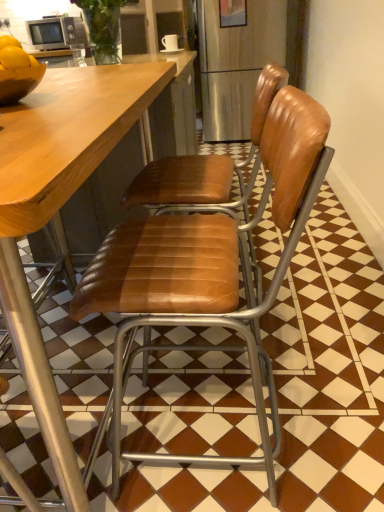
What do you see at coordinates (170, 42) in the screenshot?
I see `white glossy mug at upper center` at bounding box center [170, 42].

I want to click on brown leather chair at center, the 1th chair from the back, so click(203, 162).

Identify the location of brown leather chair at center, which ranks as the 1th chair in front-to-back order. 207,271.

Find the location of `white glossy mug at upper center`. white glossy mug at upper center is located at coordinates 170,42.

From the picture: From the image's perspective, is white glossy mug at upper center located above shiny brown bowl at left?

Yes, from the image's perspective, white glossy mug at upper center is above shiny brown bowl at left.

Would you say white glossy mug at upper center contains shiny brown bowl at left?

No, shiny brown bowl at left is not inside white glossy mug at upper center.

Does white glossy mug at upper center have a smaller size compared to shiny brown bowl at left?

Indeed, white glossy mug at upper center has a smaller size compared to shiny brown bowl at left.

Who is shorter, white glossy mug at upper center or shiny brown bowl at left?

shiny brown bowl at left is shorter.

Which is less distant, (214,168) or (45,21)?

The point (214,168) is closer.

In the scene shown: Considering the sizes of objects brown leather chair at center, acting as the second chair starting from the front, and matte silver microwave at upper left in the image provided, who is bigger, brown leather chair at center, acting as the second chair starting from the front, or matte silver microwave at upper left?

Bigger between the two is brown leather chair at center, acting as the second chair starting from the front.

Looking at this image, is matte silver microwave at upper left not within shiny brown bowl at left?

matte silver microwave at upper left lies outside shiny brown bowl at left's area.

Is matte silver microwave at upper left positioned before shiny brown bowl at left?

No, matte silver microwave at upper left is further to the viewer.

Can you confirm if white glossy mug at upper center is bigger than brown leather chair at center, the 1th chair from the back?

Incorrect, white glossy mug at upper center is not larger than brown leather chair at center, the 1th chair from the back.

Is point (169, 50) positioned after point (264, 115)?

That is True.

From a real-world perspective, is white glossy mug at upper center physically above brown leather chair at center, acting as the second chair starting from the front?

Indeed, from a real-world perspective, white glossy mug at upper center stands above brown leather chair at center, acting as the second chair starting from the front.

Looking at this image, how different are the orientations of matte silver microwave at upper left and brown leather chair at center, which appears as the second chair when viewed from the back, in degrees?

92.4 degrees separate the facing orientations of matte silver microwave at upper left and brown leather chair at center, which appears as the second chair when viewed from the back.

From the image's perspective, who appears lower, matte silver microwave at upper left or brown leather chair at center, which ranks as the 1th chair in front-to-back order?

brown leather chair at center, which ranks as the 1th chair in front-to-back order, from the image's perspective.

Between point (46, 36) and point (127, 455), which one is positioned in front?

Positioned in front is point (127, 455).

Who is more distant, matte silver microwave at upper left or brown leather chair at center, which ranks as the 1th chair in front-to-back order?

matte silver microwave at upper left.

Is matte silver microwave at upper left far from brown leather chair at center, the 1th chair from the back?

Indeed, matte silver microwave at upper left is not near brown leather chair at center, the 1th chair from the back.

From their relative heights in the image, would you say matte silver microwave at upper left is taller or shorter than brown leather chair at center, acting as the second chair starting from the front?

Clearly, matte silver microwave at upper left is shorter compared to brown leather chair at center, acting as the second chair starting from the front.

Can we say matte silver microwave at upper left lies outside brown leather chair at center, acting as the second chair starting from the front?

Yes, matte silver microwave at upper left is outside of brown leather chair at center, acting as the second chair starting from the front.

From a real-world perspective, does matte silver microwave at upper left sit lower than brown leather chair at center, the 1th chair from the back?

No, from a real-world perspective, matte silver microwave at upper left is not under brown leather chair at center, the 1th chair from the back.

Is the depth of brown leather chair at center, acting as the second chair starting from the front, greater than that of brown leather chair at center, which ranks as the 1th chair in front-to-back order?

Yes, it is.

Looking at the image, does brown leather chair at center, acting as the second chair starting from the front, seem bigger or smaller compared to brown leather chair at center, which ranks as the 1th chair in front-to-back order?

Clearly, brown leather chair at center, acting as the second chair starting from the front, is larger in size than brown leather chair at center, which ranks as the 1th chair in front-to-back order.

Choose the correct answer: Is brown leather chair at center, acting as the second chair starting from the front, inside brown leather chair at center, which ranks as the 1th chair in front-to-back order, or outside it?

brown leather chair at center, acting as the second chair starting from the front, is located beyond the bounds of brown leather chair at center, which ranks as the 1th chair in front-to-back order.

Locate an element on the screen. This screenshot has width=384, height=512. bowl lying in front of the white glossy mug at upper center is located at coordinates (19, 82).

Image resolution: width=384 pixels, height=512 pixels. I want to click on microwave oven to the left of brown leather chair at center, acting as the second chair starting from the front, so click(56, 33).

Which object lies further to the anchor point brown leather chair at center, which ranks as the 1th chair in front-to-back order, brown leather chair at center, acting as the second chair starting from the front, or shiny brown bowl at left?

Among the two, shiny brown bowl at left is located further to brown leather chair at center, which ranks as the 1th chair in front-to-back order.

When comparing their distances from brown leather chair at center, the 1th chair from the back, does shiny brown bowl at left or brown leather chair at center, which appears as the second chair when viewed from the back, seem closer?

brown leather chair at center, which appears as the second chair when viewed from the back, lies closer to brown leather chair at center, the 1th chair from the back, than the other object.

Considering their positions, is white glossy mug at upper center positioned further to shiny brown bowl at left than brown leather chair at center, which appears as the second chair when viewed from the back?

Among the two, white glossy mug at upper center is located further to shiny brown bowl at left.

Based on their spatial positions, is brown leather chair at center, which ranks as the 1th chair in front-to-back order, or matte silver microwave at upper left further from shiny brown bowl at left?

The object further to shiny brown bowl at left is matte silver microwave at upper left.

From the image, which object appears to be farther from white glossy mug at upper center, brown leather chair at center, which appears as the second chair when viewed from the back, or shiny brown bowl at left?

Among the two, brown leather chair at center, which appears as the second chair when viewed from the back, is located further to white glossy mug at upper center.

Estimate the real-world distances between objects in this image. Which object is closer to matte silver microwave at upper left, white glossy mug at upper center or brown leather chair at center, the 1th chair from the back?

white glossy mug at upper center is closer to matte silver microwave at upper left.

Looking at the image, which one is located closer to matte silver microwave at upper left, brown leather chair at center, the 1th chair from the back, or white glossy mug at upper center?

white glossy mug at upper center is closer to matte silver microwave at upper left.

Which object lies further to the anchor point shiny brown bowl at left, white glossy mug at upper center or matte silver microwave at upper left?

matte silver microwave at upper left.

Where is `chair between shiny brown bowl at left and white glossy mug at upper center in the front-back direction`? The image size is (384, 512). chair between shiny brown bowl at left and white glossy mug at upper center in the front-back direction is located at coordinates (203, 162).

Find the location of `coffee cup between brown leather chair at center, which appears as the second chair when viewed from the back, and matte silver microwave at upper left from front to back`. coffee cup between brown leather chair at center, which appears as the second chair when viewed from the back, and matte silver microwave at upper left from front to back is located at coordinates (170, 42).

At what (x,y) coordinates should I click in order to perform the action: click on chair positioned between brown leather chair at center, which ranks as the 1th chair in front-to-back order, and white glossy mug at upper center from near to far. Please return your answer as a coordinate pair (x, y). Image resolution: width=384 pixels, height=512 pixels. Looking at the image, I should click on (203, 162).

At what (x,y) coordinates should I click in order to perform the action: click on bowl between brown leather chair at center, which appears as the second chair when viewed from the back, and matte silver microwave at upper left in the front-back direction. Please return your answer as a coordinate pair (x, y). This screenshot has height=512, width=384. Looking at the image, I should click on (19, 82).